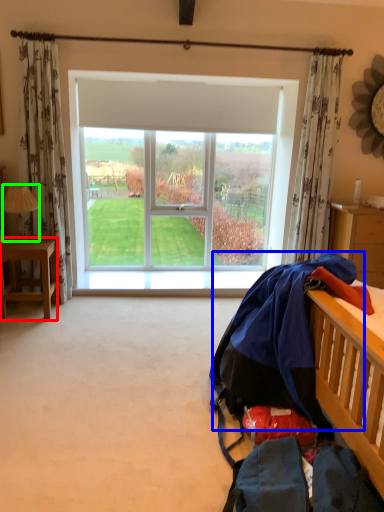
Question: Considering the real-world distances, which object is closest to desk (highlighted by a red box)? clothing (highlighted by a blue box) or lamp (highlighted by a green box).

Choices:
 (A) clothing
 (B) lamp

Answer: (B)